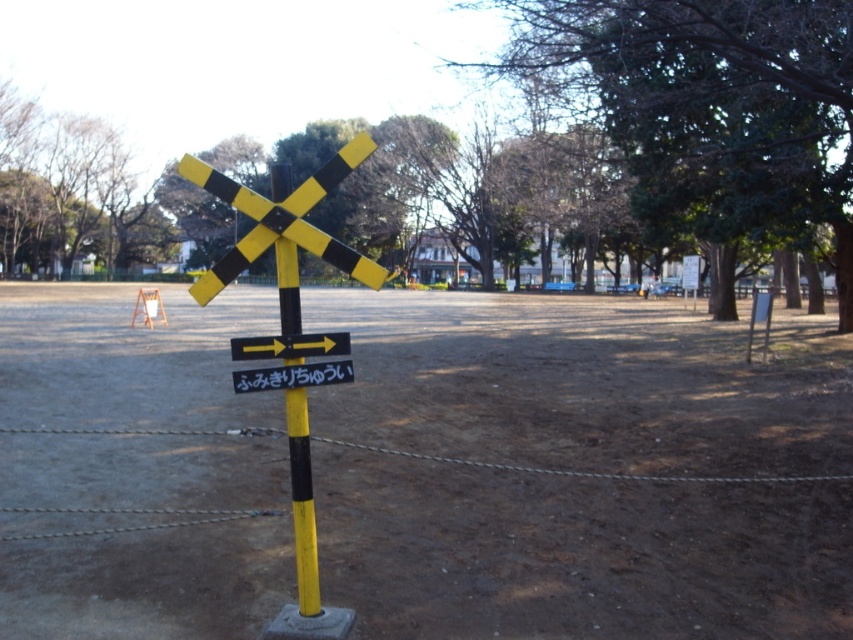
Which is in front, point (311, 369) or point (326, 346)?

Point (326, 346)

Is yellow/black plastic sign at center shorter than yellow plastic arrow at center?

No, yellow/black plastic sign at center is not shorter than yellow plastic arrow at center.

Consider the image. Measure the distance between point (x=300, y=368) and camera.

They are 3.90 meters apart.

Identify the location of yellow/black plastic sign at center. (x=292, y=376).

Does yellow matte pole at center appear on the right side of yellow/black plastic sign at center?

In fact, yellow matte pole at center is to the left of yellow/black plastic sign at center.

Is yellow matte pole at center to the left of yellow/black plastic sign at center from the viewer's perspective?

Yes, yellow matte pole at center is to the left of yellow/black plastic sign at center.

Locate an element on the screen. This screenshot has width=853, height=640. yellow matte pole at center is located at coordinates (302, 502).

Between brown dirt field at center and yellow/black plastic sign at center, which one has less height?

yellow/black plastic sign at center is shorter.

Does point (283, 580) lie in front of point (335, 378)?

No, (283, 580) is behind (335, 378).

This screenshot has height=640, width=853. What are the coordinates of `brown dirt field at center` in the screenshot? It's located at (577, 554).